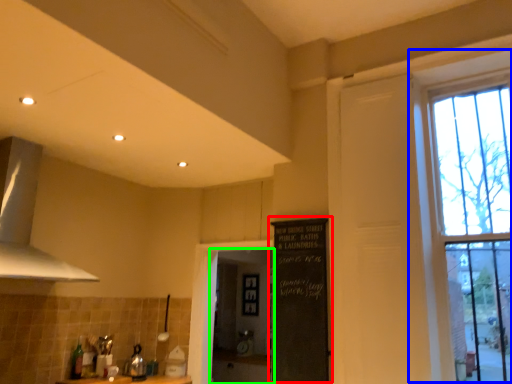
Question: Considering the real-world distances, which object is closest to bulletin board (highlighted by a red box)? window (highlighted by a blue box) or screen door (highlighted by a green box).

Choices:
 (A) window
 (B) screen door

Answer: (A)